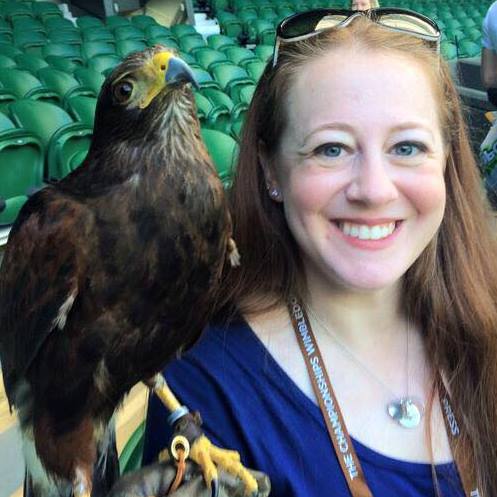
Image resolution: width=497 pixels, height=497 pixels. In order to click on pendant in this screenshot , I will do `click(405, 412)`.